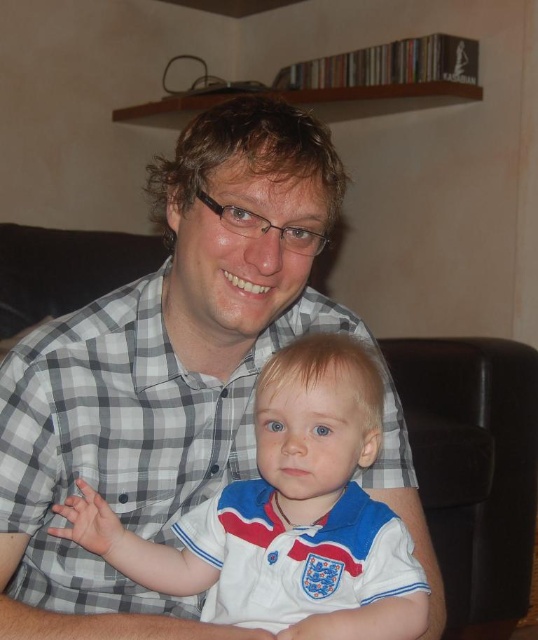
Question: Is checkered fabric shirt at center above white cotton shirt at center?

Choices:
 (A) no
 (B) yes

Answer: (B)

Question: Which point is farther to the camera?

Choices:
 (A) checkered fabric shirt at center
 (B) white cotton shirt at center

Answer: (A)

Question: Can you confirm if checkered fabric shirt at center is thinner than white cotton shirt at center?

Choices:
 (A) no
 (B) yes

Answer: (A)

Question: Is checkered fabric shirt at center smaller than white cotton shirt at center?

Choices:
 (A) yes
 (B) no

Answer: (B)